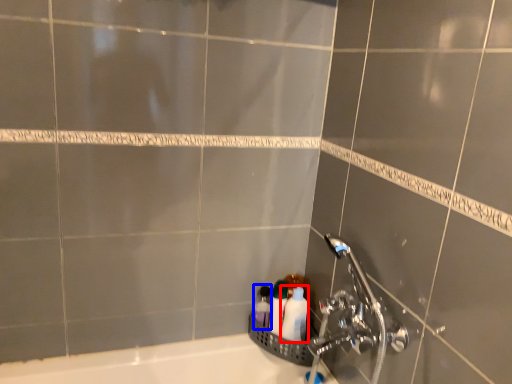
Question: Among these objects, which one is nearest to the camera, toiletry (highlighted by a red box) or toiletry (highlighted by a blue box)?

Choices:
 (A) toiletry
 (B) toiletry

Answer: (A)